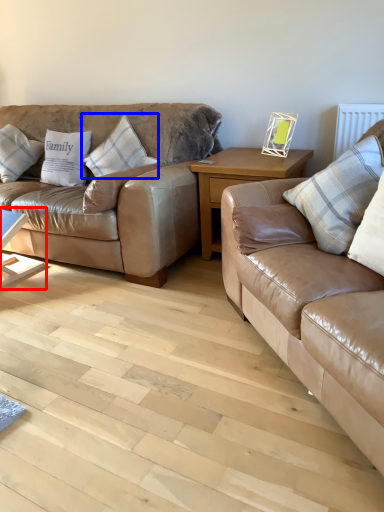
Question: Which object is closer to the camera taking this photo, table (highlighted by a red box) or pillow (highlighted by a blue box)?

Choices:
 (A) table
 (B) pillow

Answer: (A)